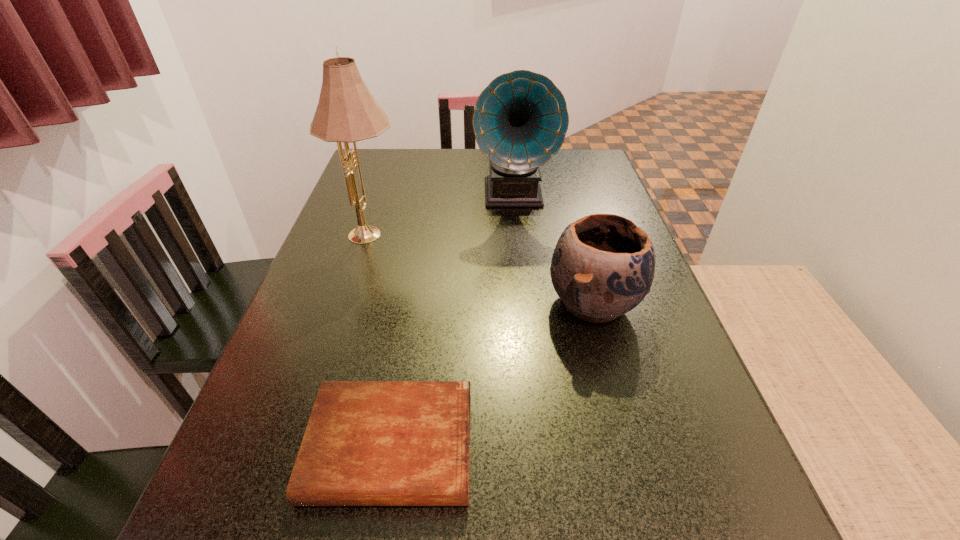
Where is `free point between the third shortest object and the shortest object`? The width and height of the screenshot is (960, 540). free point between the third shortest object and the shortest object is located at coordinates (452, 321).

Find the location of a particular element. This screenshot has width=960, height=540. empty space between the third tallest object and the phonograph_record is located at coordinates (554, 249).

Where is `empty space that is in between the phonograph_record and the tallest object`? The height and width of the screenshot is (540, 960). empty space that is in between the phonograph_record and the tallest object is located at coordinates (443, 215).

You are a GUI agent. You are given a task and a screenshot of the screen. Output one action in this format:
    pyautogui.click(x=<x>, y=<y>)
    Task: Click on the empty space between the tallest object and the nearest object
    The image size is (960, 540).
    Given the screenshot: What is the action you would take?
    pyautogui.click(x=381, y=341)

This screenshot has height=540, width=960. Identify the location of free space between the lampshade and the nearest object. (381, 341).

Find the location of a particular element. The height and width of the screenshot is (540, 960). empty space that is in between the shortest object and the second nearest object is located at coordinates (492, 375).

Where is `vacant area that lies between the pottery and the third shortest object`? The width and height of the screenshot is (960, 540). vacant area that lies between the pottery and the third shortest object is located at coordinates (554, 249).

Locate an element on the screen. This screenshot has width=960, height=540. object that stands as the second closest to the nearest object is located at coordinates (346, 112).

Choose which object is the second nearest neighbor to the lampshade. Please provide its 2D coordinates. Your answer should be formatted as a tuple, i.e. [(x, y)], where the tuple contains the x and y coordinates of a point satisfying the conditions above.

[(603, 265)]

This screenshot has height=540, width=960. I want to click on free space that satisfies the following two spatial constraints: 1. from the horn of the third farthest object; 2. on the right side of the phonograph_record, so click(525, 303).